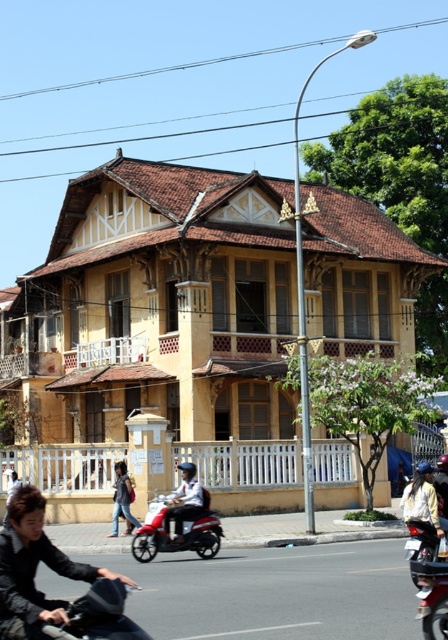
Question: Which point is farther from the camera taking this photo?

Choices:
 (A) (106, 593)
 (B) (143, 531)
 (C) (8, 518)
 (D) (412, 531)

Answer: (B)

Question: Which object is closer to the camera taking this photo?

Choices:
 (A) light brown leather jacket at lower center
 (B) black matte motorcycle at lower left
 (C) shiny red motorcycle at center

Answer: (B)

Question: Does matte black motorcycle at lower left have a lesser width compared to metallic red motorcycle at lower right?

Choices:
 (A) yes
 (B) no

Answer: (A)

Question: Which point is farther from the camera taking this photo?

Choices:
 (A) [115, 516]
 (B) [27, 566]

Answer: (A)

Question: Does black matte motorcycle at lower left appear under shiny red motorcycle at center?

Choices:
 (A) yes
 (B) no

Answer: (B)

Question: Can you confirm if black matte motorcycle at lower left is smaller than shiny red motorcycle at center?

Choices:
 (A) no
 (B) yes

Answer: (B)